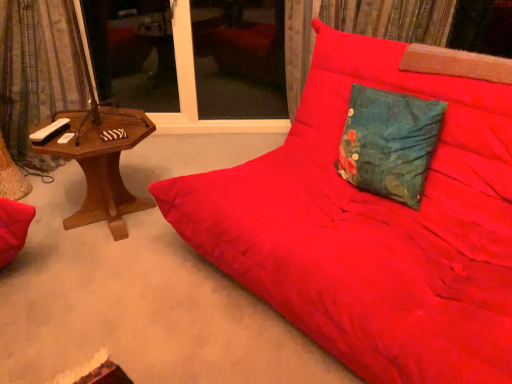
I want to click on free space in front of transparent glass window at center, which is the 1th window screen in right-to-left order, so click(244, 133).